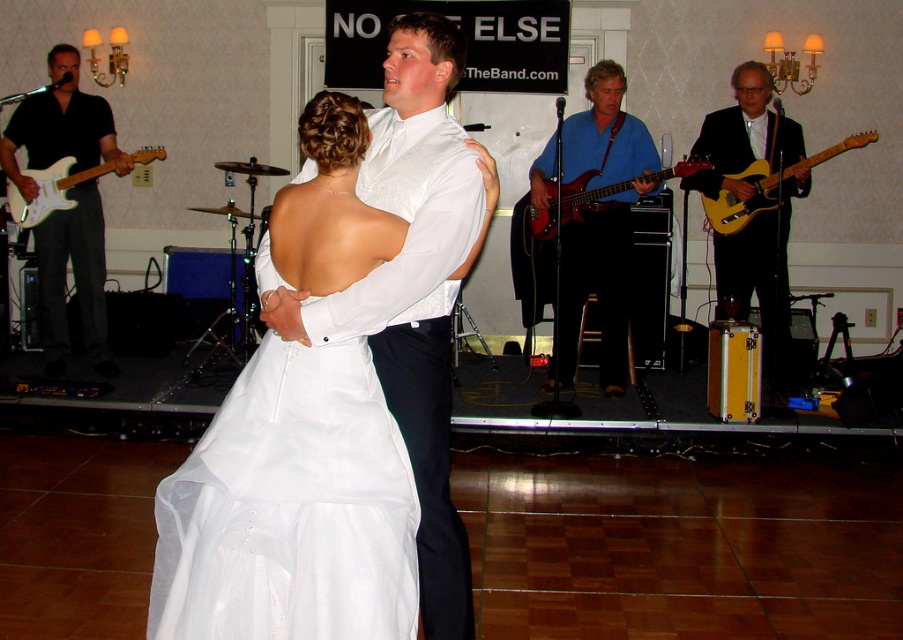
You are a photographer at the wedding reception and want to capture a photo of the shiny gold guitar at right and the glossy wood bass guitar at center. Which guitar is located to the right of the other?

The shiny gold guitar at right is positioned on the right side of the glossy wood bass guitar at center.

You are a photographer at the wedding reception. You want to capture a photo that includes both the white satin dress at center and the blue fabric guitar at center. Which object should you focus on first if you want to ensure both are in the frame without moving the camera?

The white satin dress at center is shorter than the blue fabric guitar at center, so you should focus on the blue fabric guitar at center first to ensure both are in the frame.